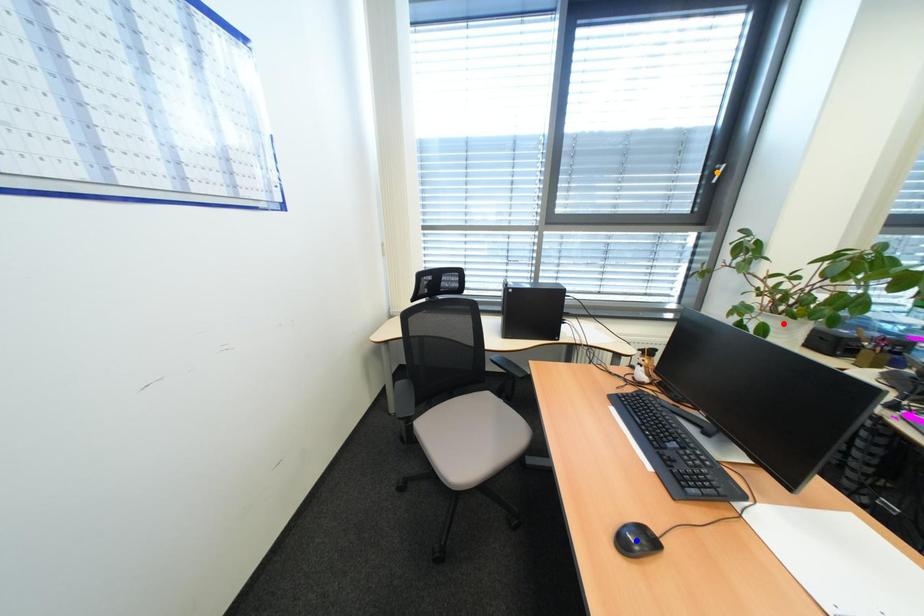
Order these from nearest to farthest:
blue point | orange point | red point

1. orange point
2. red point
3. blue point